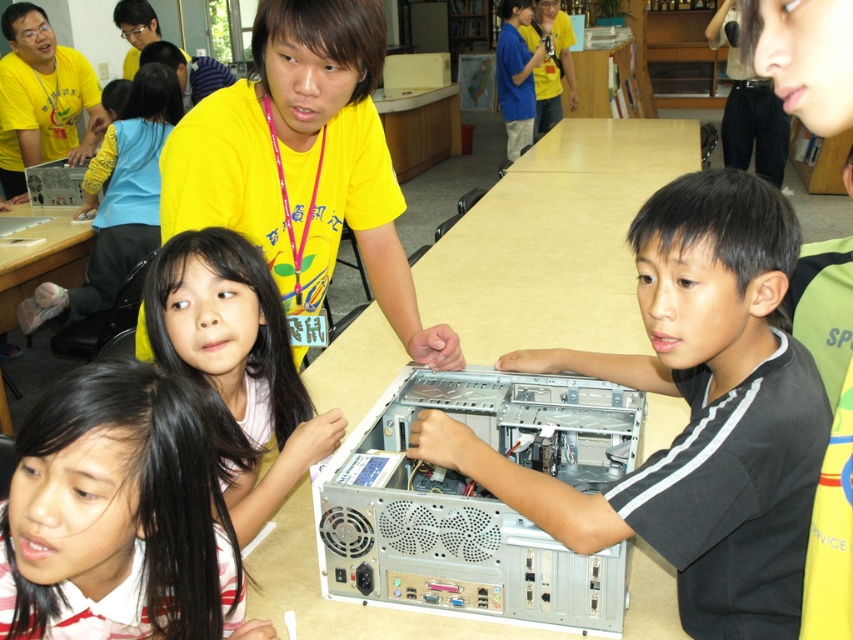
You are a teacher observing the classroom scene. You notice two students wearing matte yellow shirts. Which student is closer to you, the one wearing the matte yellow shirt at center or the one wearing the matte yellow shirt at upper center?

The matte yellow shirt at center is smaller than the matte yellow shirt at upper center. Since objects closer to the viewer appear larger, the matte yellow shirt at upper center is closer to you.

Looking at the classroom scene, where is the matte yellow shirt at center in relation to the matte yellow shirt at upper center?

The matte yellow shirt at center is to the right of the matte yellow shirt at upper center.